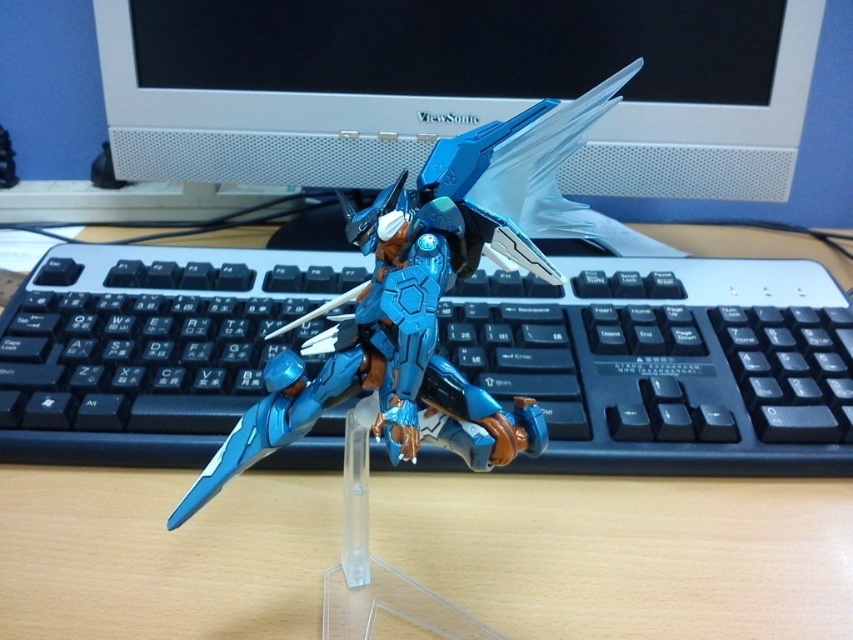
You are organizing a display and want to place a decorative plant between the wooden table at center and the metallic blue robot at center. Is there enough space between them for the plant?

The wooden table at center is located below the metallic blue robot at center, so there is vertical space between them. However, since the robot is placed on the table, there might not be enough horizontal space for a plant between them.

You are trying to place a small decorative item on the wooden table at center. However, you notice there is already a white plastic monitor at upper center on it. Can the monitor be moved to make space for the item?

The wooden table at center is thinner than the white plastic monitor at upper center, so the monitor cannot be moved because it is wider than the table itself.